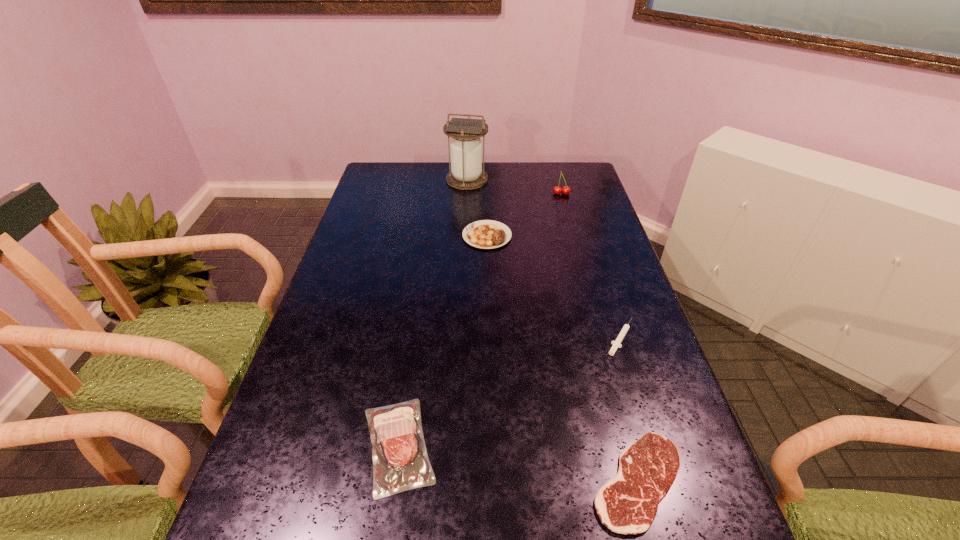
I want to click on object that is the fourth closest to the lantern, so click(398, 446).

Choose which steak is the nearest neighbor to the tallest object. Please provide its 2D coordinates. Your answer should be formatted as a tuple, i.e. [(x, y)], where the tuple contains the x and y coordinates of a point satisfying the conditions above.

[(487, 234)]

The width and height of the screenshot is (960, 540). I want to click on steak that is the third closest to the second shortest object, so click(398, 446).

This screenshot has height=540, width=960. Find the location of `free space that satisfies the following two spatial constraints: 1. on the front side of the syringe; 2. on the right side of the fourth shortest object`. free space that satisfies the following two spatial constraints: 1. on the front side of the syringe; 2. on the right side of the fourth shortest object is located at coordinates (489, 337).